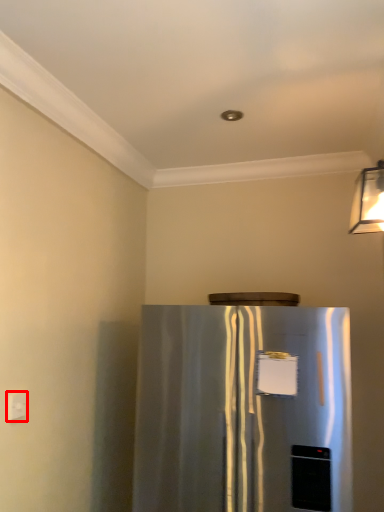
Question: From the image's perspective, considering the relative positions of electric outlet (annotated by the red box) and refrigerator in the image provided, where is electric outlet (annotated by the red box) located with respect to the staircase?

Choices:
 (A) below
 (B) above

Answer: (B)